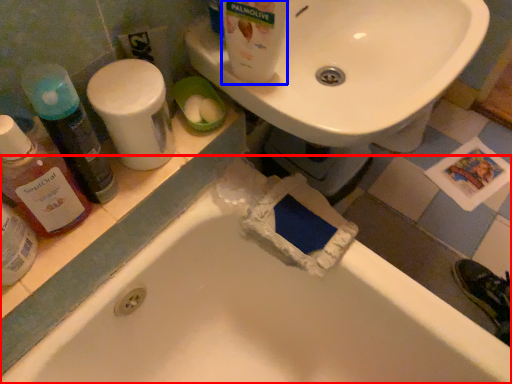
Question: Which point is closer to the camera, bathtub (highlighted by a red box) or cleaning product (highlighted by a blue box)?

Choices:
 (A) bathtub
 (B) cleaning product

Answer: (A)